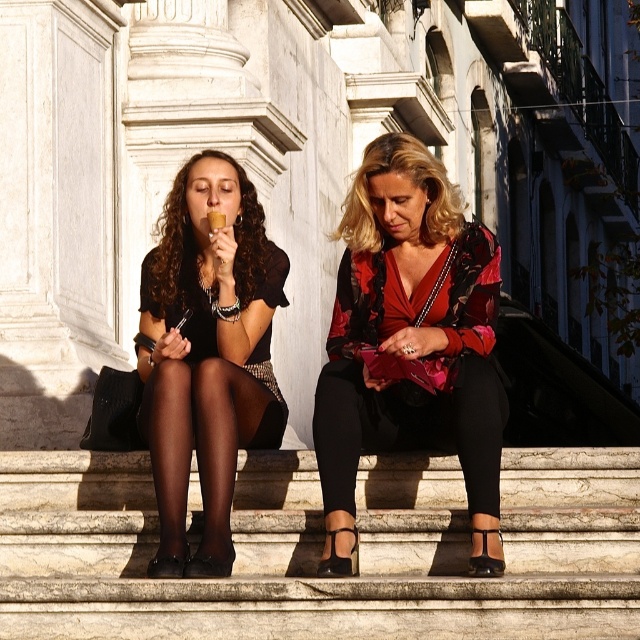
You are standing in front of the stone steps where the two people are sitting. You want to place a small flower pot at the point that is closer to you. Which point should you choose between point (412, 228) and point (212, 170)?

Point (412, 228) is closer to the camera than point (212, 170), so you should choose point (412, 228) to place the flower pot since it is closer to you.